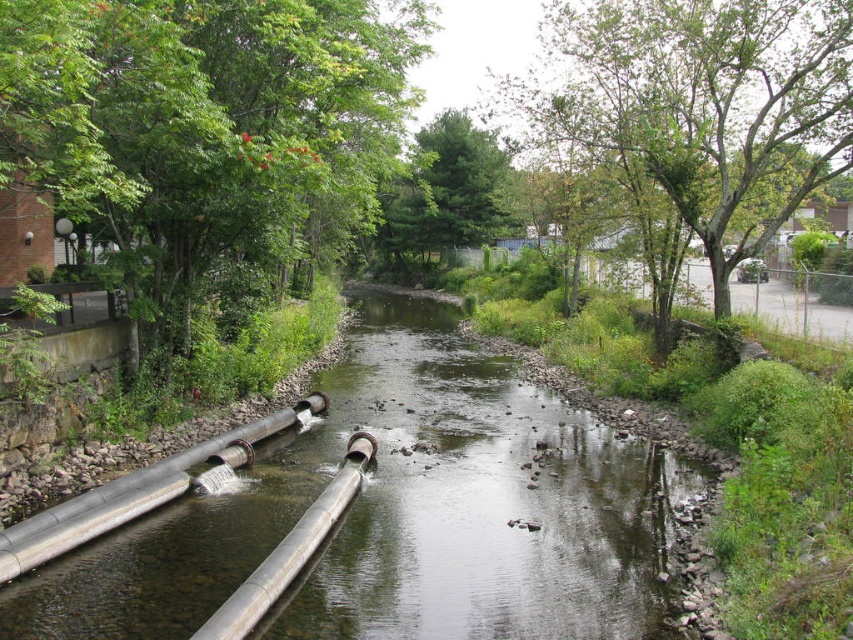
Question: Which of the following is the farthest from the observer?

Choices:
 (A) (135, 70)
 (B) (344, 465)
 (C) (57, 508)
 (D) (654, 83)

Answer: (D)

Question: Which object is positioned closest to the green leafy tree at upper left?

Choices:
 (A) silver metallic pipe at center
 (B) green leafy tree at upper right
 (C) green matte tree at center
 (D) gray rubber water pipe at center-left

Answer: (B)

Question: Which point is farther to the camera?

Choices:
 (A) (427, 253)
 (B) (635, 147)
 (C) (128, 480)

Answer: (A)

Question: Is green leafy tree at upper right to the left of gray rubber water pipe at center-left from the viewer's perspective?

Choices:
 (A) yes
 (B) no

Answer: (B)

Question: Can you confirm if green leafy tree at upper left is positioned below silver metallic pipe at center?

Choices:
 (A) no
 (B) yes

Answer: (A)

Question: Can you confirm if gray rubber water pipe at center-left is positioned above silver metallic pipe at center?

Choices:
 (A) no
 (B) yes

Answer: (B)